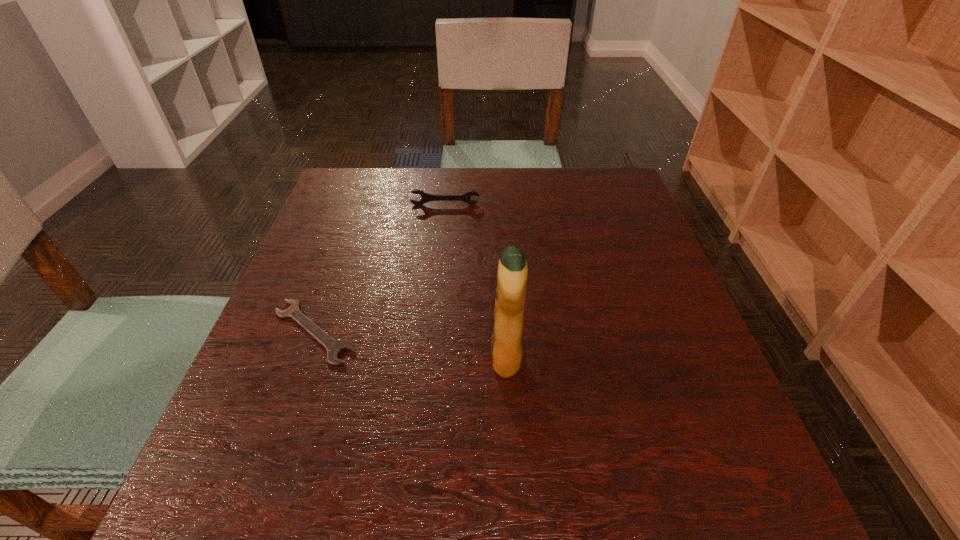
Locate an element on the screen. The height and width of the screenshot is (540, 960). vacant space located 0.370m on the back of the shorter wrench is located at coordinates (361, 201).

Where is `object situated at the far edge`? The width and height of the screenshot is (960, 540). object situated at the far edge is located at coordinates (425, 197).

Find the location of a particular element. object located at the left edge is located at coordinates (334, 347).

The image size is (960, 540). In order to click on vacant space at the far edge of the desktop in this screenshot , I will do `click(542, 181)`.

You are a GUI agent. You are given a task and a screenshot of the screen. Output one action in this format:
    pyautogui.click(x=<x>, y=<y>)
    Task: Click on the vacant space at the near edge of the desktop
    The width and height of the screenshot is (960, 540).
    Given the screenshot: What is the action you would take?
    pyautogui.click(x=655, y=523)

Where is `vacant space at the left edge`? Image resolution: width=960 pixels, height=540 pixels. vacant space at the left edge is located at coordinates (314, 303).

The width and height of the screenshot is (960, 540). I want to click on free space at the right edge, so click(627, 241).

In the image, there is a desktop. In order to click on vacant space at the far left corner in this screenshot , I will do `click(336, 201)`.

I want to click on unoccupied area between the second shortest object and the shortest object, so click(x=380, y=268).

This screenshot has height=540, width=960. I want to click on vacant space in between the rightmost object and the second shortest object, so click(x=476, y=281).